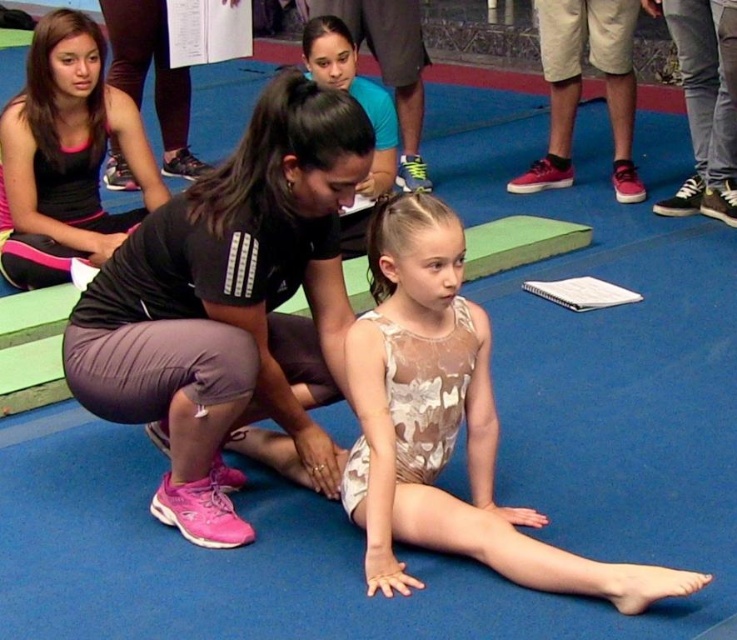
Question: Considering the real-world distances, which object is closest to the camouflage leotard at center?

Choices:
 (A) matte black squat at center
 (B) matte black tank top at upper left

Answer: (A)

Question: From the image, what is the correct spatial relationship of matte black squat at center in relation to matte black tank top at upper left?

Choices:
 (A) below
 (B) above

Answer: (A)

Question: Does matte black squat at center appear over matte black tank top at upper left?

Choices:
 (A) yes
 (B) no

Answer: (B)

Question: Which point is farther from the camera taking this photo?

Choices:
 (A) (545, 554)
 (B) (46, 180)
 (C) (192, 416)

Answer: (B)

Question: Does matte black squat at center appear on the left side of matte black tank top at upper left?

Choices:
 (A) no
 (B) yes

Answer: (A)

Question: Which point appears closest to the camera in this image?

Choices:
 (A) (468, 404)
 (B) (200, 525)
 (C) (119, 234)

Answer: (B)